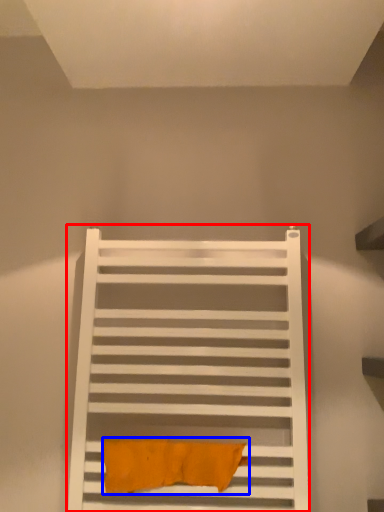
Question: Which of the following is the farthest to the observer, furniture (highlighted by a red box) or bath towel (highlighted by a blue box)?

Choices:
 (A) furniture
 (B) bath towel

Answer: (B)